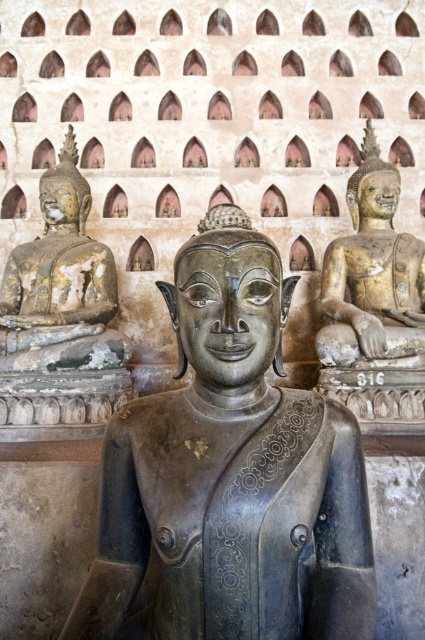
You are standing in front of the Buddha statues and want to determine which of the two points, point (x=176, y=460) or point (x=382, y=211), is nearer to you. Based on the spatial arrangement, which point is closer?

Point (x=176, y=460) is closer to the viewer than point (x=382, y=211).